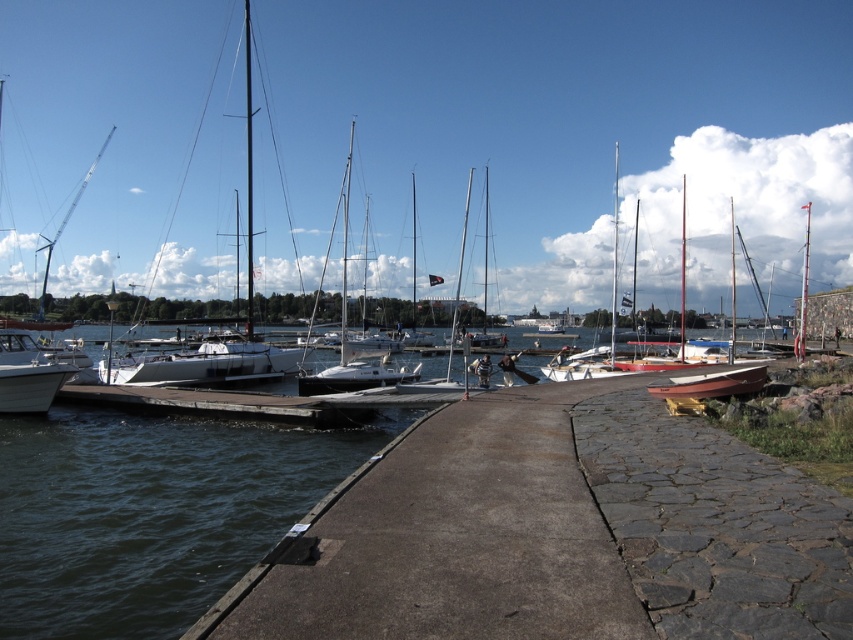
Question: Considering the relative positions of dark blue water at lower left and white matte sailboat at left in the image provided, where is dark blue water at lower left located with respect to white matte sailboat at left?

Choices:
 (A) right
 (B) left

Answer: (A)

Question: Which object is closer to the camera taking this photo?

Choices:
 (A) white matte sailboat at left
 (B) dark blue water at lower left
 (C) white glossy boat at lower left

Answer: (B)

Question: Which point appears closest to the camera in this image?

Choices:
 (A) (677, 396)
 (B) (415, 557)
 (C) (24, 358)
 (D) (68, 534)

Answer: (B)

Question: Which is nearer to the white glossy boat at lower left?

Choices:
 (A) dark blue water at lower left
 (B) wooden boat at center
 (C) concrete dock at center

Answer: (A)

Question: Observing the image, what is the correct spatial positioning of concrete dock at center in reference to wooden boat at center?

Choices:
 (A) left
 (B) right

Answer: (A)

Question: Is dark blue water at lower left wider than white matte sailboat at left?

Choices:
 (A) no
 (B) yes

Answer: (A)